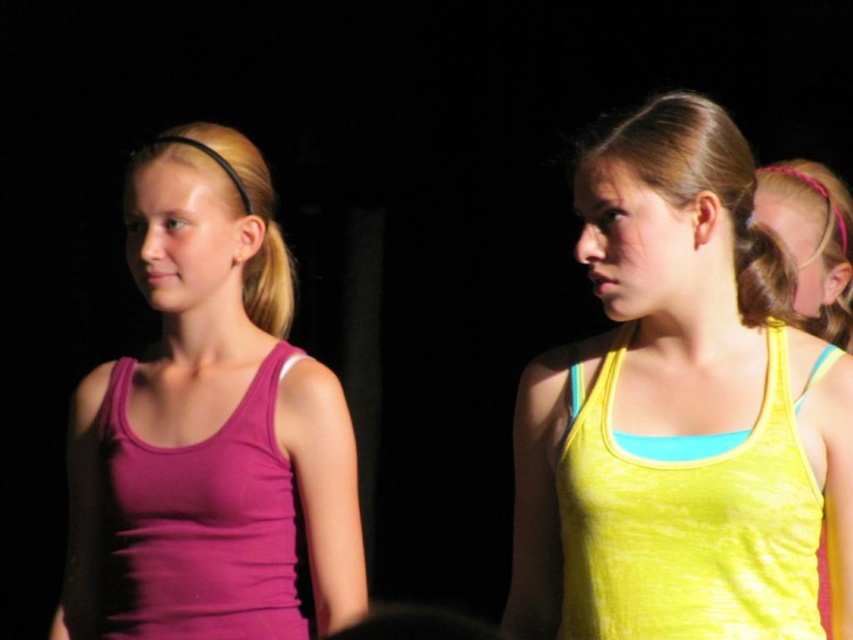
Question: Among these objects, which one is farthest from the camera?

Choices:
 (A) purple matte tank top at left
 (B) pink hairband at upper right
 (C) blonde hair at left

Answer: (C)

Question: Among these points, which one is nearest to the camera?

Choices:
 (A) (816, 486)
 (B) (129, 608)

Answer: (A)

Question: Is matte purple tank top at left thinner than pink hairband at upper right?

Choices:
 (A) no
 (B) yes

Answer: (A)

Question: Can you confirm if yellow matte tank top at center is positioned above purple matte tank top at left?

Choices:
 (A) yes
 (B) no

Answer: (A)

Question: Which object is farther from the camera taking this photo?

Choices:
 (A) yellow fabric vest at right
 (B) matte purple tank top at left
 (C) blonde hair at left
 (D) yellow matte tank top at center

Answer: (C)

Question: Is purple matte tank top at left further to camera compared to matte purple tank top at left?

Choices:
 (A) no
 (B) yes

Answer: (B)